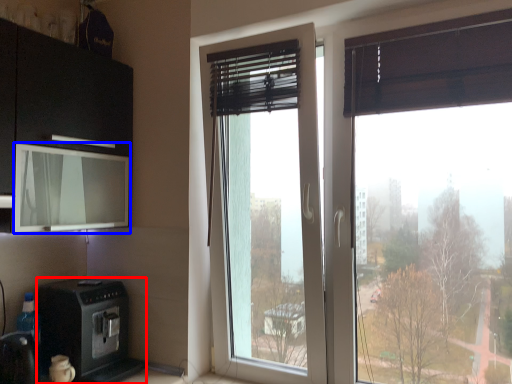
Question: Which of the following is the farthest to the observer, home appliance (highlighted by a red box) or window screen (highlighted by a blue box)?

Choices:
 (A) home appliance
 (B) window screen

Answer: (A)